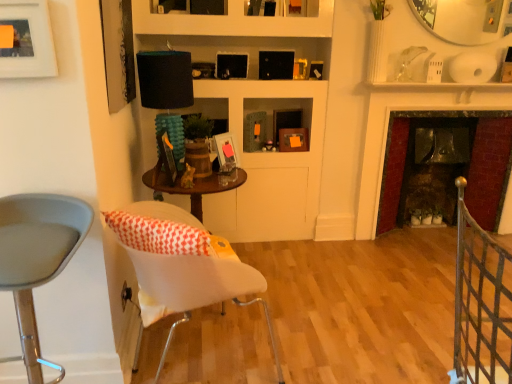
Question: Is black metal gate at lower right to the left or to the right of matte wooden picture frame at center, positioned as the second picture frame in back-to-front order, in the image?

Choices:
 (A) left
 (B) right

Answer: (B)

Question: From a real-world perspective, is black metal gate at lower right positioned above or below matte wooden picture frame at center, the 4th picture frame viewed from the left?

Choices:
 (A) below
 (B) above

Answer: (A)

Question: Considering the real-world distances, which object is closest to the matte white picture frame at upper left, positioned as the 1th picture frame in left-to-right order?

Choices:
 (A) black metal gate at lower right
 (B) matte black picture frame at upper center, the fifth picture frame in the front-to-back sequence
 (C) white plastic chair at center, the first chair from the right
 (D) gray plastic stool at left, arranged as the second chair when viewed from the right
 (E) dark red brick fireplace at right

Answer: (D)

Question: Based on their relative distances, which object is farther from the matte black picture frame at upper center, marked as the 5th picture frame in a left-to-right arrangement?

Choices:
 (A) wooden picture frame at center, positioned as the 3th picture frame in front-to-back order
 (B) matte black picture frame at upper left, the fourth picture frame when ordered from right to left
 (C) matte white picture frame at upper left, positioned as the 1th picture frame in left-to-right order
 (D) white plastic chair at center, marked as the second chair in a left-to-right arrangement
 (E) dark red brick fireplace at right

Answer: (C)